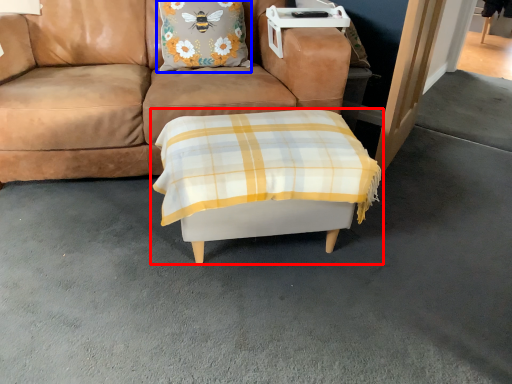
Question: Among these objects, which one is nearest to the camera, table (highlighted by a red box) or pillow (highlighted by a blue box)?

Choices:
 (A) table
 (B) pillow

Answer: (A)